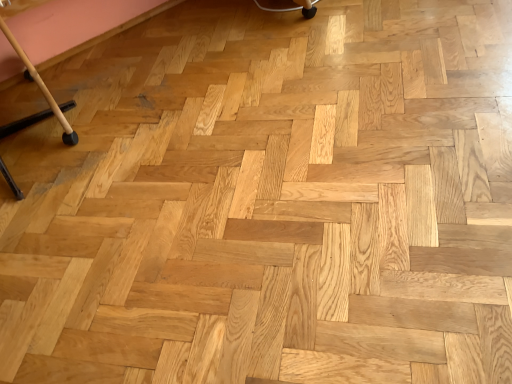
This screenshot has height=384, width=512. Identify the location of free space below wooden cane at left (from a real-world perspective). (26, 130).